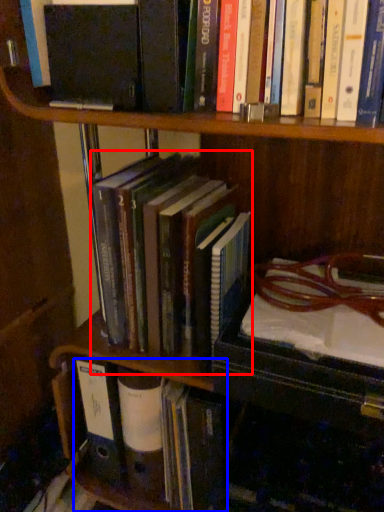
Question: Which object appears farthest to the camera in this image, book (highlighted by a red box) or book (highlighted by a blue box)?

Choices:
 (A) book
 (B) book

Answer: (B)